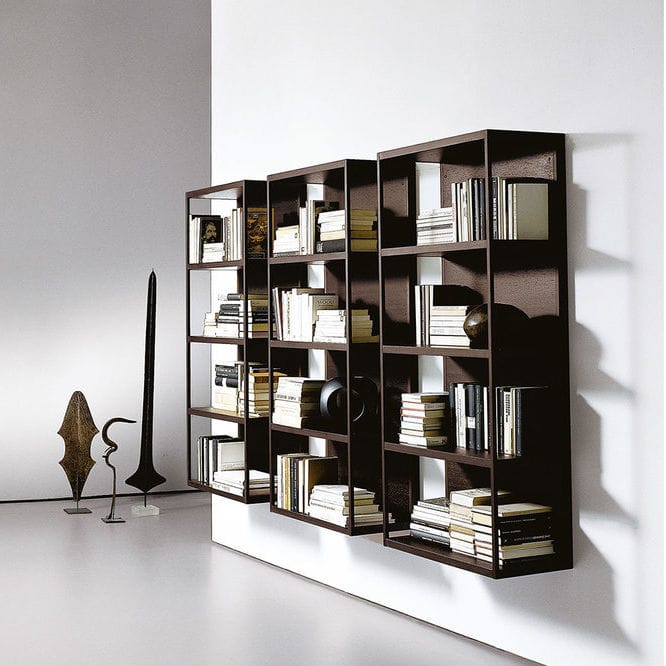
Image resolution: width=666 pixels, height=666 pixels. In order to click on bookshelf three in this screenshot , I will do click(x=474, y=214), click(x=440, y=316), click(x=442, y=421), click(x=467, y=513).